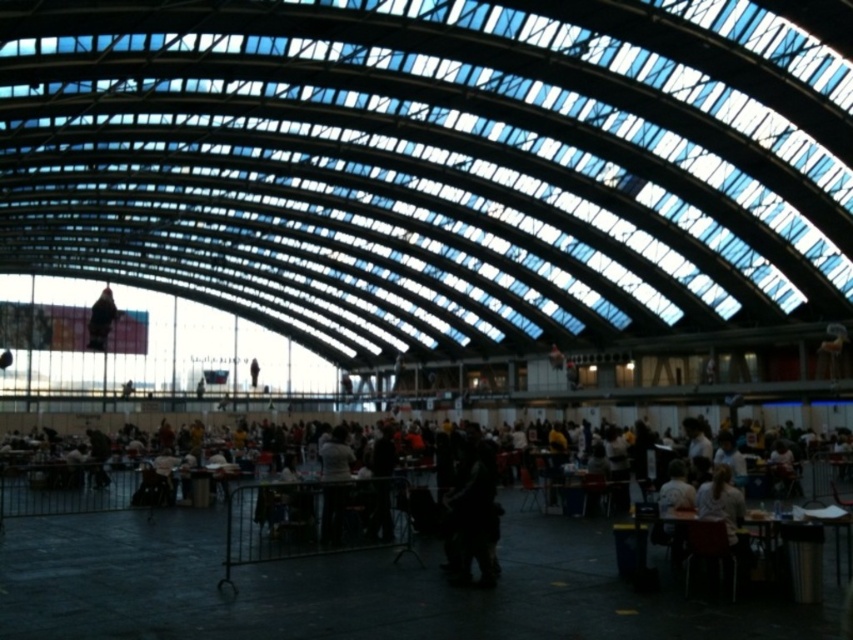
Does dark gray jacket at center appear under wooden table at lower right?

Yes.

Describe the element at coordinates (311, 518) in the screenshot. I see `dark gray jacket at center` at that location.

Where is `dark gray jacket at center`? The height and width of the screenshot is (640, 853). dark gray jacket at center is located at coordinates (311, 518).

Does dark gray jacket at center have a greater width compared to dark fabric bag at center?

Correct, the width of dark gray jacket at center exceeds that of dark fabric bag at center.

Which is more to the left, dark gray jacket at center or dark fabric bag at center?

dark gray jacket at center

Image resolution: width=853 pixels, height=640 pixels. What do you see at coordinates (311, 518) in the screenshot? I see `dark gray jacket at center` at bounding box center [311, 518].

I want to click on dark gray jacket at center, so click(311, 518).

Between dark fabric bag at center and wooden table at lower right, which one appears on the right side from the viewer's perspective?

wooden table at lower right

Is point (447, 502) positioned behind point (642, 515)?

That is True.

Is point (469, 440) positioned after point (676, 561)?

Yes.

Identify the location of dark fabric bag at center. (473, 513).